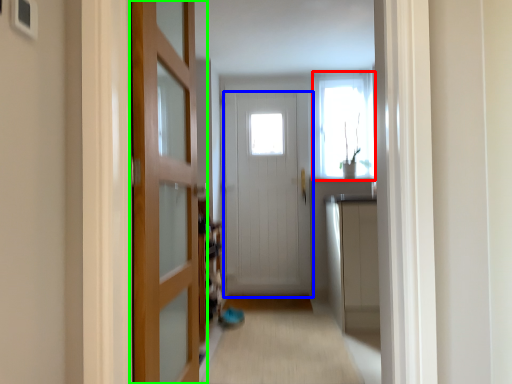
Question: Estimate the real-world distances between objects in this image. Which object is closer to window (highlighted by a red box), door (highlighted by a blue box) or door (highlighted by a green box)?

Choices:
 (A) door
 (B) door

Answer: (A)